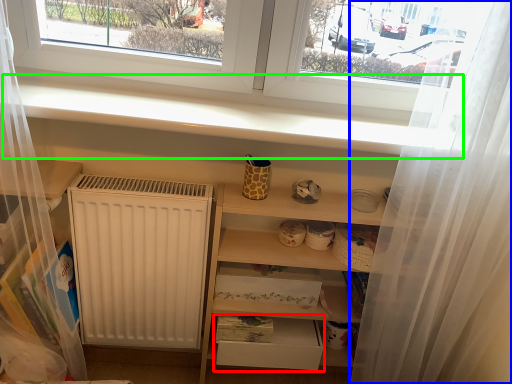
Question: Estimate the real-world distances between objects in this image. Which object is farther from drawer (highlighted by a red box), shower curtain (highlighted by a blue box) or window sill (highlighted by a green box)?

Choices:
 (A) shower curtain
 (B) window sill

Answer: (B)